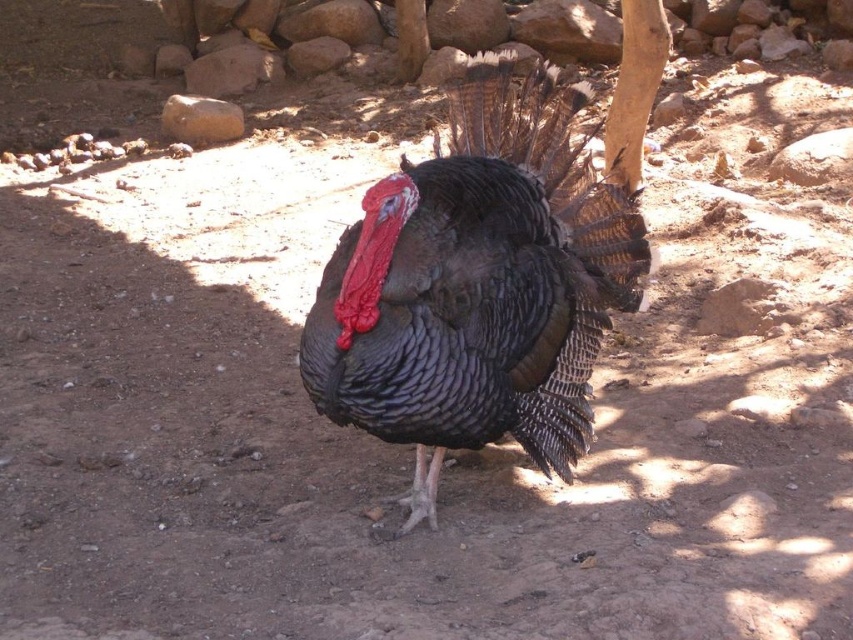
Based on the photo, you are a turkey in the image and want to move from the smooth brown rock at upper left to the smooth brown rock at upper center. Which direction should you face to walk towards the second rock?

The smooth brown rock at upper left is to the left of smooth brown rock at upper center. So the turkey should face towards the right direction to walk towards the smooth brown rock at upper center.

You are a photographer trying to capture a closeup of the shiny black turkey at center. However, you notice the gray rock at center is blocking part of the turkey. Can you determine if the turkey is positioned in front of or behind the rock?

The shiny black turkey at center is in front of the gray rock at center, so it is not behind the rock. The rock is blocking part of the turkey because the turkey is closer to the camera than the rock.

You are a photographer trying to capture the turkey in the scene. You notice two points marked in the image. The first point is at coordinate point (x=579, y=266), and the second is at coordinate point (x=190, y=90). If you want to position your camera so that both points are visible, which point should you focus on first to ensure both are in frame?

You should focus on point (x=579, y=266) first because it is in front of point (x=190, y=90), so focusing on the closer point will help ensure both are in frame.